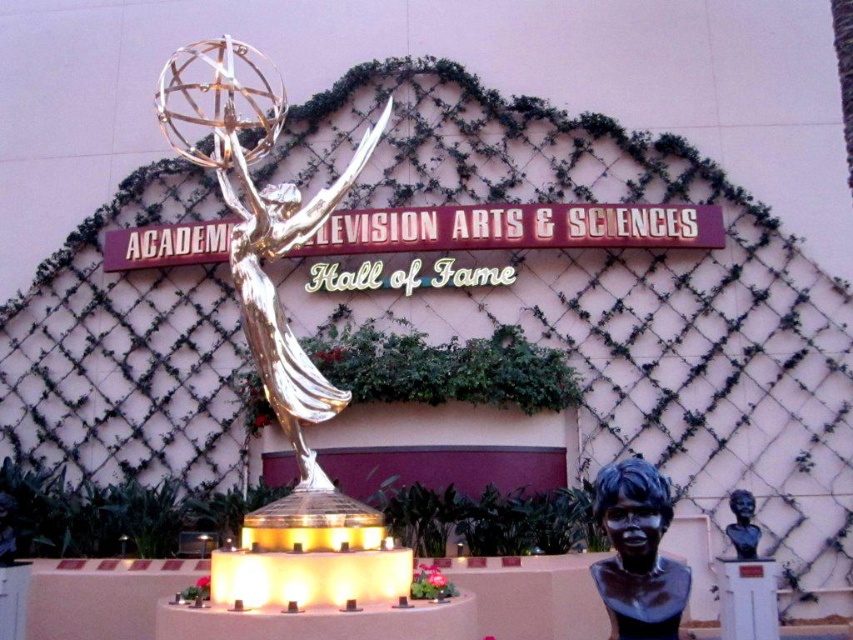
Consider the image. You are a photographer setting up for an event at the Academy of Television Arts Hall of Fame. You need to position a camera to capture both the gold metallic emmy statue at center and the black polished bust at lower right in the frame. Considering their sizes, which object should you focus on first to ensure proper framing?

The gold metallic emmy statue at center is bigger than the black polished bust at lower right, so you should focus on the gold metallic emmy statue at center first to ensure it is centered and properly framed before adjusting for the smaller black polished bust at lower right.

You are a visitor standing at the entrance of the Academy of Television Arts and Sciences Hall of Fame. You see the shiny silver bust at lower right and the black polished bust at lower right. If you want to take a photo that includes both of them in the frame, will you need to zoom out your camera lens?

The distance between the shiny silver bust at lower right and the black polished bust at lower right is 11.85 meters. To include both in the frame, you would need to zoom out your camera lens to capture the wide angle required for such a separation.